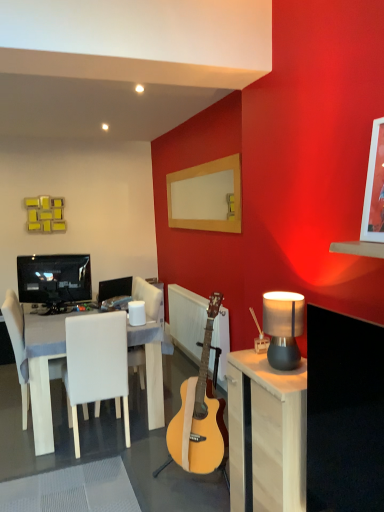
Question: In terms of size, does light wood cabinet at right appear bigger or smaller than wooden frame at upper right?

Choices:
 (A) small
 (B) big

Answer: (B)

Question: In terms of height, does light wood cabinet at right look taller or shorter compared to wooden frame at upper right?

Choices:
 (A) short
 (B) tall

Answer: (B)

Question: Which object is positioned closest to the white fabric chair at left, the 2th chair from the right?

Choices:
 (A) wooden picture frame at upper right
 (B) light wood acoustic guitar at center
 (C) white leather chair at center, arranged as the first chair when viewed from the right
 (D) wooden frame at upper right
 (E) matte black monitor at center, which is the 1th television in back-to-front order

Answer: (C)

Question: Estimate the real-world distances between objects in this image. Which object is closer to the wooden picture frame at upper right?

Choices:
 (A) wooden frame at upper right
 (B) light wood acoustic guitar at center
 (C) white wood table at left
 (D) white fabric chair at left, acting as the first chair starting from the left
 (E) light wood cabinet at right

Answer: (E)